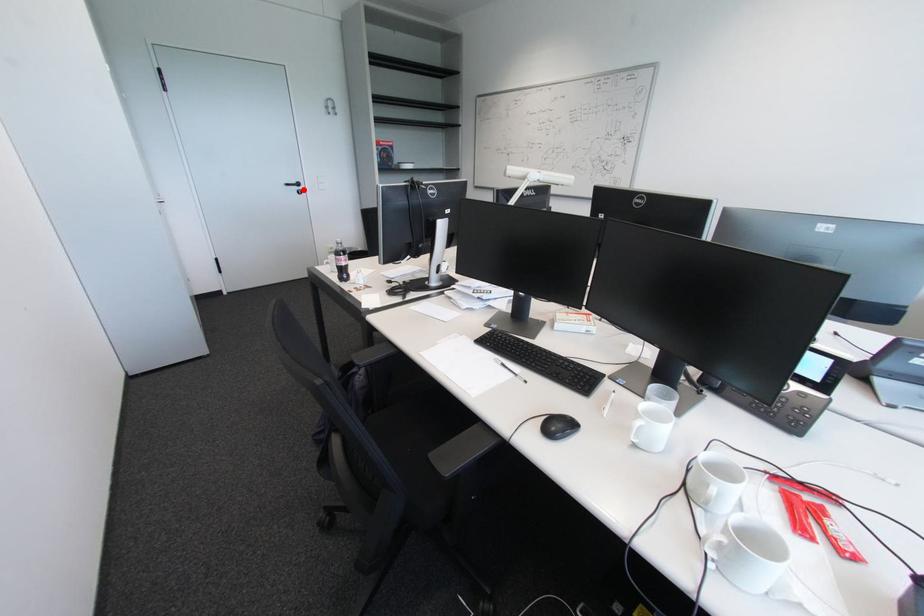
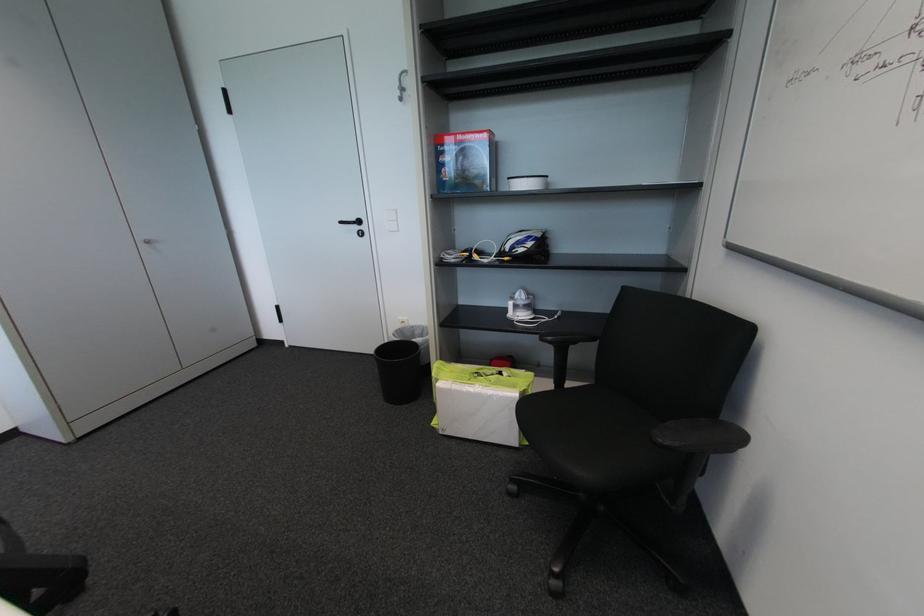
Locate, in the second image, the point that corresponds to the highlighted location in the first image.

(362, 229)